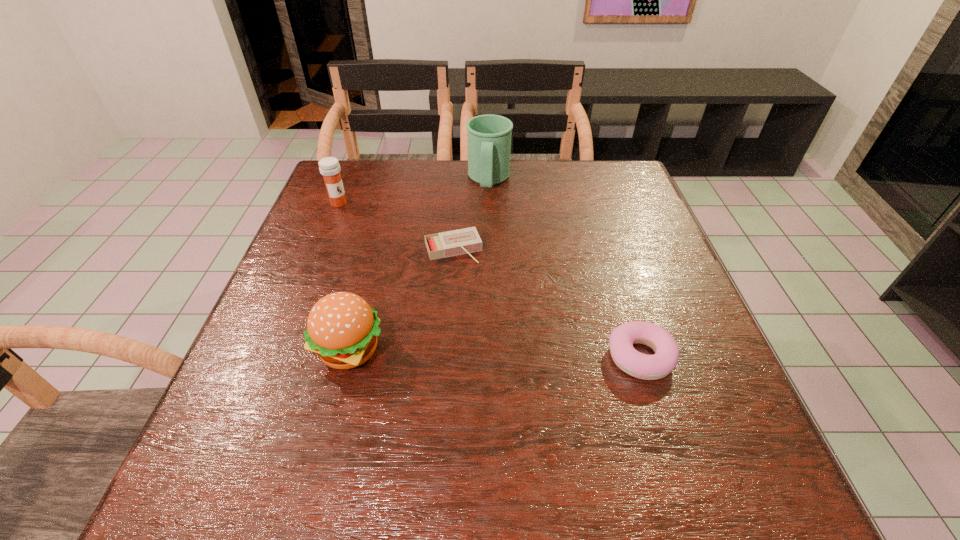
Where is `the second object from left to right`? The image size is (960, 540). the second object from left to right is located at coordinates (342, 328).

In order to click on the second shortest object in this screenshot , I will do `click(647, 367)`.

You are a GUI agent. You are given a task and a screenshot of the screen. Output one action in this format:
    pyautogui.click(x=<x>, y=<y>)
    Task: Click on the pastry
    
    Given the screenshot: What is the action you would take?
    pyautogui.click(x=647, y=367)

The image size is (960, 540). What are the coordinates of `matchbox` in the screenshot? It's located at (462, 241).

Locate an element on the screen. The height and width of the screenshot is (540, 960). the third nearest object is located at coordinates (462, 241).

I want to click on the leftmost object, so click(329, 167).

Where is `the tallest object`? This screenshot has width=960, height=540. the tallest object is located at coordinates (489, 136).

This screenshot has height=540, width=960. In order to click on vacant area situated on the right of the hamburger in this screenshot , I will do `click(564, 349)`.

At what (x,y) coordinates should I click in order to perform the action: click on free space located 0.400m on the left of the fourth tallest object. Please return your answer as a coordinate pair (x, y). This screenshot has width=960, height=540. Looking at the image, I should click on (397, 357).

The image size is (960, 540). What are the coordinates of `blank space located on the striking surface of the matchbox` in the screenshot? It's located at (475, 299).